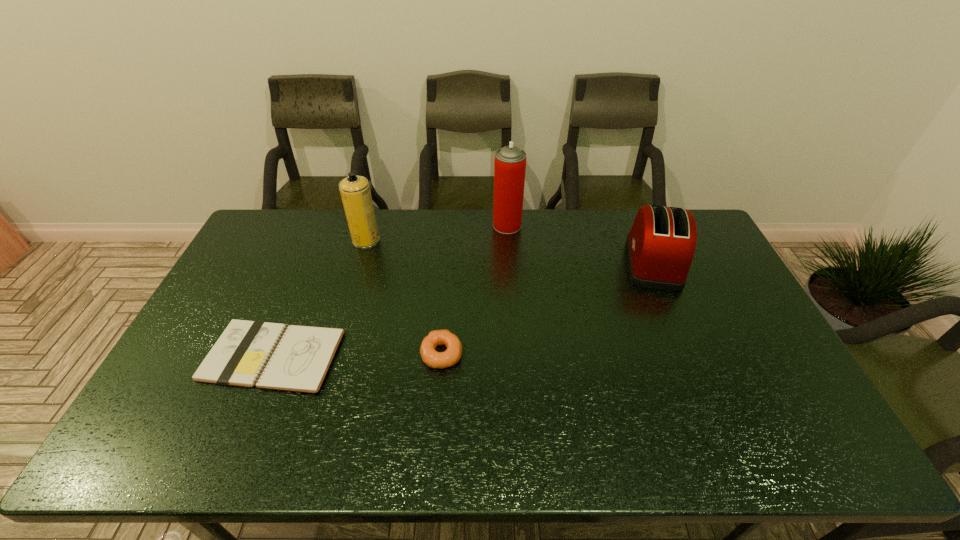
This screenshot has width=960, height=540. I want to click on vacant space that's between the left aerosol can and the shortest object, so pyautogui.click(x=320, y=298).

This screenshot has height=540, width=960. Identify the location of free space that is in between the third tallest object and the notepad. (463, 309).

At what (x,y) coordinates should I click in order to perform the action: click on free space between the tallest object and the shortest object. Please return your answer as a coordinate pair (x, y). Looking at the image, I should click on (390, 291).

Where is `free space that is in between the tallest object and the notepad`? free space that is in between the tallest object and the notepad is located at coordinates (390, 291).

Identify the location of vacant area that lies between the notepad and the fourth shortest object. (320, 298).

Find the location of a particular element. The width and height of the screenshot is (960, 540). the closest object to the toaster is located at coordinates coord(510,161).

Locate an element on the screen. object that is the fourth closest to the notepad is located at coordinates (660, 246).

Locate an element on the screen. vacant region that satisfies the following two spatial constraints: 1. on the front side of the doughnut; 2. on the left side of the fourth shortest object is located at coordinates (332, 354).